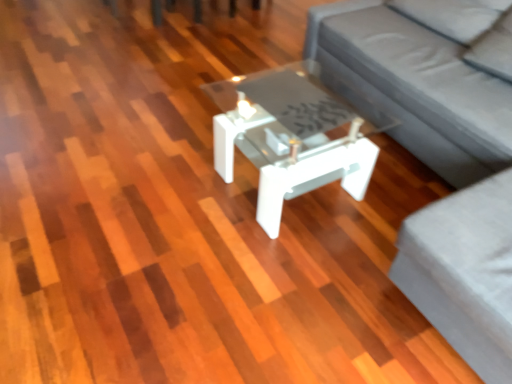
Question: Considering the positions of gray fabric couch at center and gray fabric couch at center in the image, is gray fabric couch at center wider or thinner than gray fabric couch at center?

Choices:
 (A) wide
 (B) thin

Answer: (A)

Question: From the image's perspective, is gray fabric couch at center located above or below gray fabric couch at center?

Choices:
 (A) below
 (B) above

Answer: (A)

Question: Estimate the real-world distances between objects in this image. Which object is closer to the gray fabric couch at center?

Choices:
 (A) gray fabric couch at center
 (B) white glossy coffee table at center

Answer: (A)

Question: Estimate the real-world distances between objects in this image. Which object is farther from the gray fabric couch at center?

Choices:
 (A) gray fabric couch at center
 (B) white glossy coffee table at center

Answer: (B)